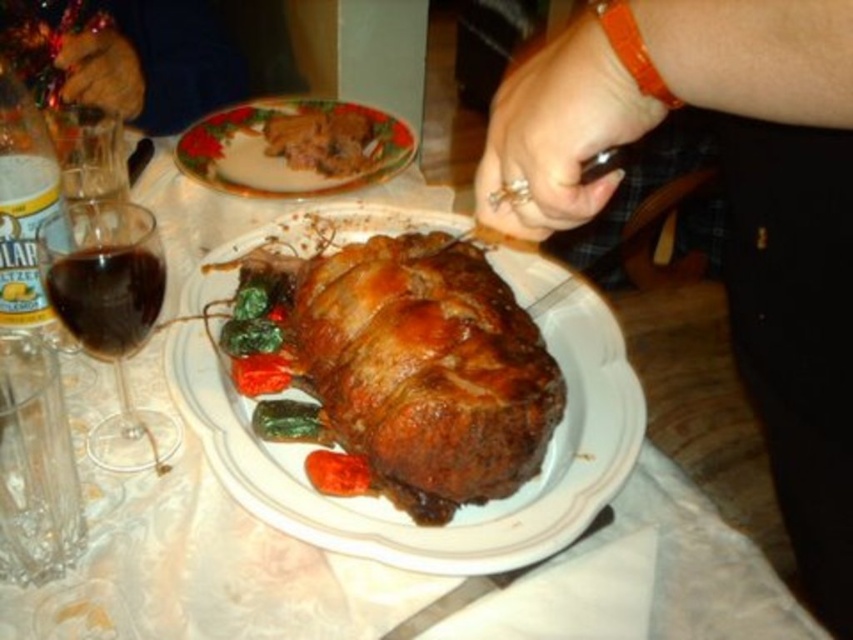
Question: Estimate the real-world distances between objects in this image. Which object is closer to the brown crispy meat at upper left?

Choices:
 (A) golden brown roasted meat at center
 (B) golden brown ceramic roast at center

Answer: (B)

Question: Does dark red liquid at left appear on the left side of brown crispy meat at upper left?

Choices:
 (A) yes
 (B) no

Answer: (A)

Question: Among these objects, which one is farthest from the camera?

Choices:
 (A) brown crispy meat at upper left
 (B) shiny metal knife at lower center

Answer: (A)

Question: From the image, what is the correct spatial relationship of smooth brown ham at center in relation to brown crispy meat at upper left?

Choices:
 (A) below
 (B) above

Answer: (A)

Question: Does golden brown roasted meat at center lie in front of matte ceramic plate at upper center?

Choices:
 (A) no
 (B) yes

Answer: (B)

Question: Among these objects, which one is farthest from the camera?

Choices:
 (A) golden brown roasted meat at center
 (B) shiny metal knife at lower center

Answer: (A)